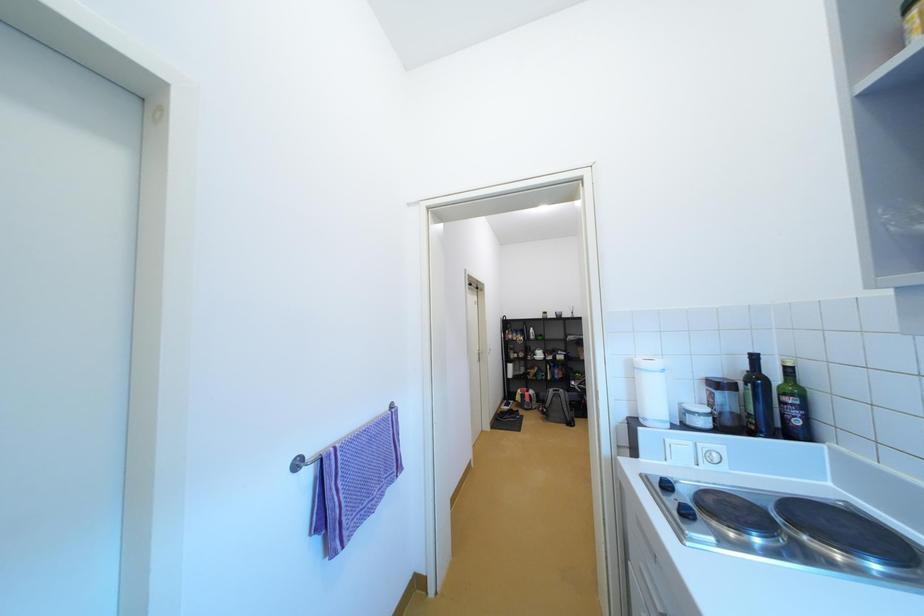
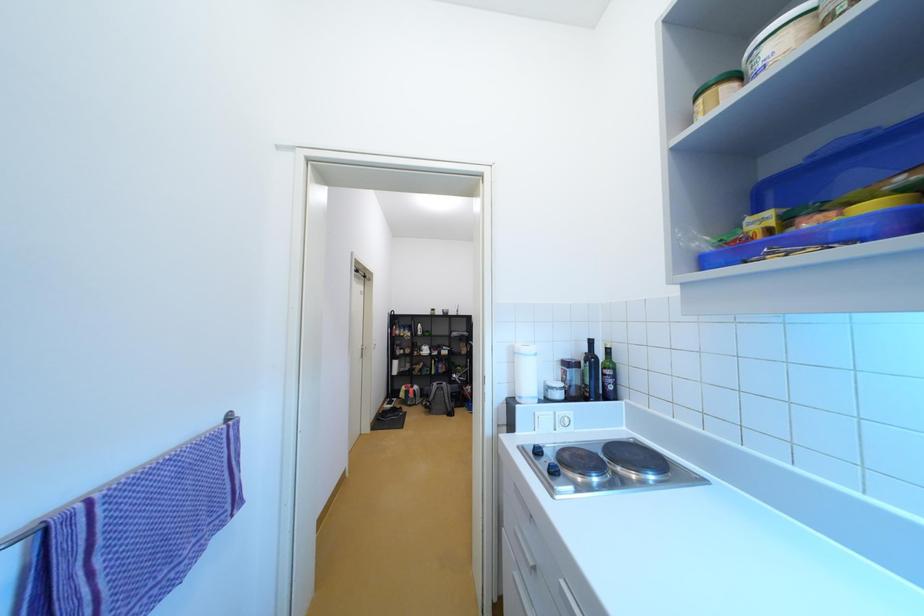
Question: The camera is either moving clockwise (left) or counter-clockwise (right) around the object. The first image is from the beginning of the video and the second image is from the end. Is the camera moving left or right when shooting the video?

Choices:
 (A) Left
 (B) Right

Answer: (A)